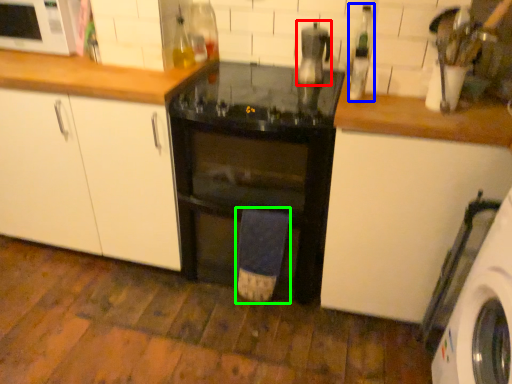
Question: Which object is the farthest from appliance (highlighted by a red box)? Choose among these: bottle (highlighted by a blue box) or bath towel (highlighted by a green box).

Choices:
 (A) bottle
 (B) bath towel

Answer: (B)